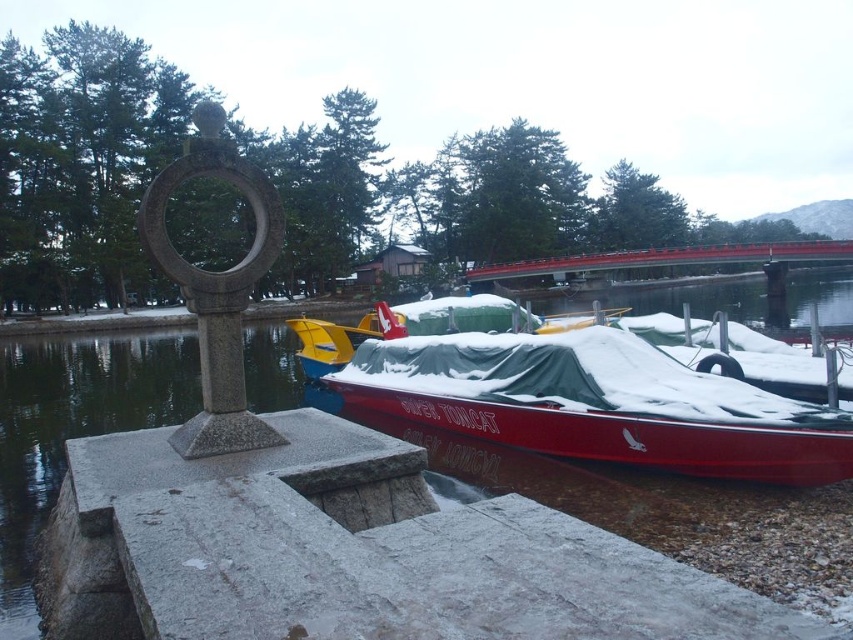
Can you confirm if red glossy boat at center is shorter than red wood bridge at upper center?

Correct, red glossy boat at center is not as tall as red wood bridge at upper center.

Does red glossy boat at center have a greater height compared to red wood bridge at upper center?

No.

Locate an element on the screen. The height and width of the screenshot is (640, 853). red glossy boat at center is located at coordinates pos(596,403).

At what (x,y) coordinates should I click in order to perform the action: click on red glossy boat at center. Please return your answer as a coordinate pair (x, y). Looking at the image, I should click on (596, 403).